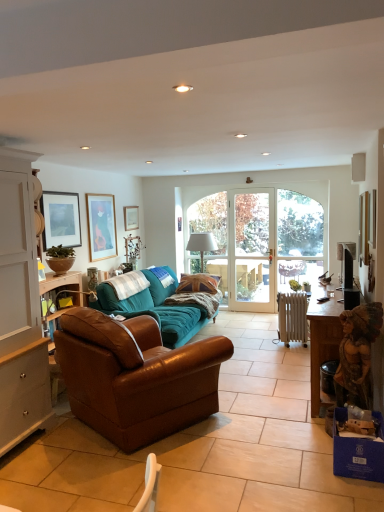
Identify the location of vacant space in front of brown leather couch at center, acting as the 2th studio couch starting from the back. (140, 479).